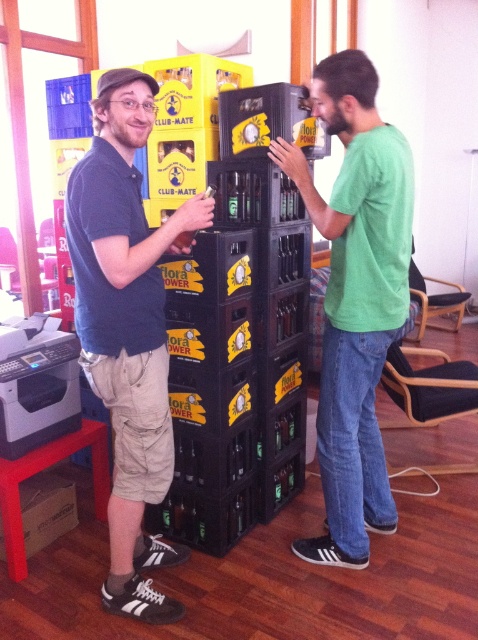
You are a photographer adjusting your camera to focus on two points in the image. The first point is at coordinates point (x=139, y=609) and the second is at point (x=33, y=406). Which point should you focus on first if you want to capture the closer one?

Point (x=139, y=609) is closer to the camera than point (x=33, y=406), so you should focus on point (x=139, y=609) first.

You are a delivery person who needs to place a package between the matte black shirt at left and the black matte printer at left. The package is 20 inches long. Will it fit in the space between them?

The distance between the matte black shirt at left and the black matte printer at left is 21.06 inches, so the 20 inches long package will fit in the space between them.

You are a photographer setting up for a photoshoot in the room. You need to position a spotlight so it illuminates both the matte black shirt at left and the green matte shirt at center without casting shadows on the wooden floor. Given their positions, where should you place the spotlight relative to the two shirts?

The spotlight should be placed above the green matte shirt at center since the matte black shirt at left is positioned under it, allowing the light to reach both shirts without casting shadows on the floor.